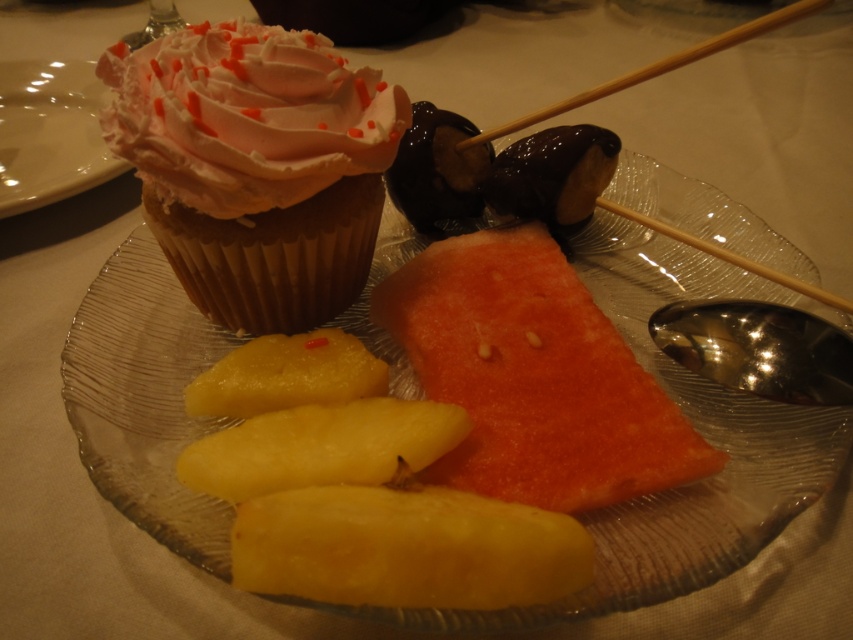
Question: Is the position of translucent glass plate at upper center more distant than that of yellow smooth pineapple at lower center?

Choices:
 (A) yes
 (B) no

Answer: (A)

Question: Which point is closer to the camera taking this photo?

Choices:
 (A) (463, 362)
 (B) (416, 512)
 (C) (260, 189)

Answer: (B)

Question: Which is farther from the wooden chopstick at upper center?

Choices:
 (A) yellow smooth pineapple at lower center
 (B) translucent glass plate at upper center
 (C) red smooth watermelon at center
 (D) matte pink cupcake at upper left

Answer: (D)

Question: Among these points, which one is nearest to the camera?

Choices:
 (A) (595, 492)
 (B) (718, 35)
 (C) (248, 84)
 (D) (660, 230)

Answer: (A)

Question: Where is translucent glass plate at upper center located in relation to matte pink cupcake at upper left in the image?

Choices:
 (A) right
 (B) left

Answer: (A)

Question: Is matte pink frosting cupcake at upper left above yellow smooth pineapple at lower center?

Choices:
 (A) no
 (B) yes

Answer: (B)